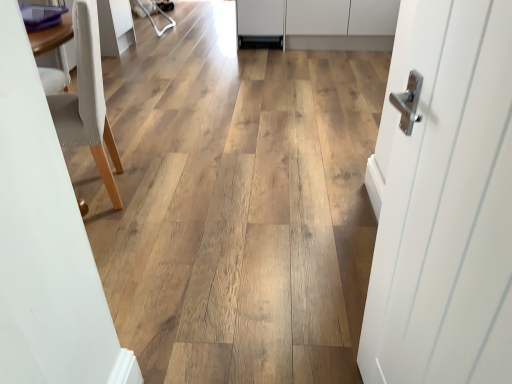
Where is `vacant region to the left of white matte cabinet at upper center`? vacant region to the left of white matte cabinet at upper center is located at coordinates coord(192,49).